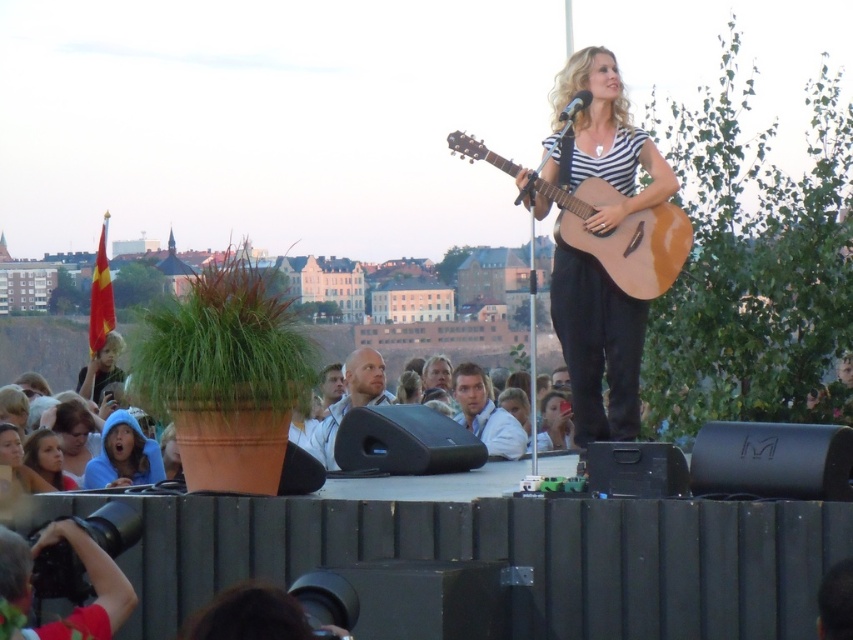
How far apart are light blue shirt at center and matte blue shirt at center?

A distance of 31.88 meters exists between light blue shirt at center and matte blue shirt at center.

Does light blue shirt at center appear over matte blue shirt at center?

Indeed, light blue shirt at center is positioned over matte blue shirt at center.

The width and height of the screenshot is (853, 640). Describe the element at coordinates (486, 413) in the screenshot. I see `light blue shirt at center` at that location.

Where is `light blue shirt at center`? The height and width of the screenshot is (640, 853). light blue shirt at center is located at coordinates (486, 413).

Does natural wood acoustic guitar at center have a lesser width compared to light blue shirt at center?

No, natural wood acoustic guitar at center is not thinner than light blue shirt at center.

Is point (636, 250) farther from viewer compared to point (503, 410)?

No.

Describe the element at coordinates (622, 236) in the screenshot. I see `natural wood acoustic guitar at center` at that location.

What are the coordinates of `natural wood acoustic guitar at center` in the screenshot? It's located at (622, 236).

Is blue hoodie at lower left shorter than matte black guitar at center?

No.

Is blue hoodie at lower left to the left of matte black guitar at center from the viewer's perspective?

Yes, blue hoodie at lower left is to the left of matte black guitar at center.

Does point (126, 456) lie behind point (546, 413)?

No.

Locate an element on the screen. blue hoodie at lower left is located at coordinates (123, 456).